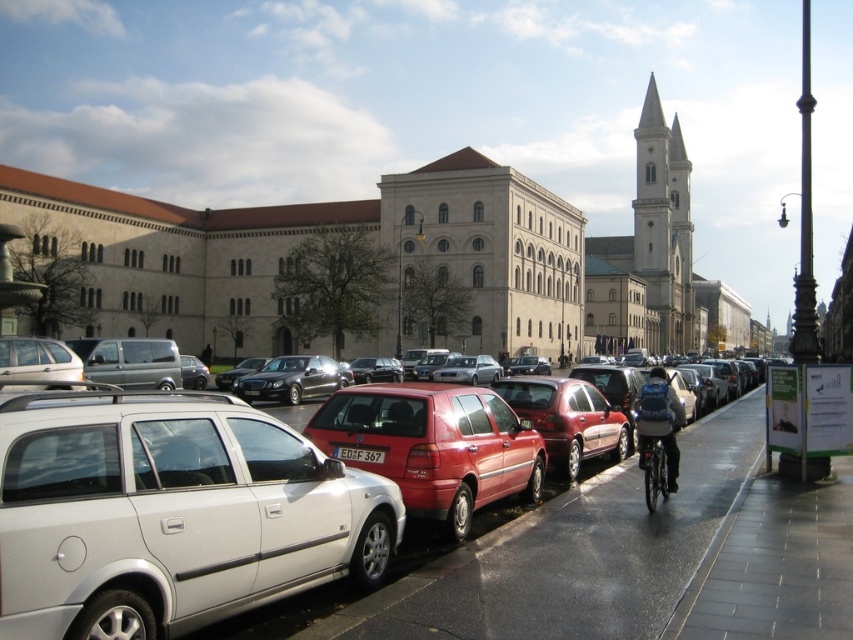
Question: Which object appears farthest from the camera in this image?

Choices:
 (A) metallic silver bicycle at right
 (B) white plastic license plate at center
 (C) matte red hatchback at center

Answer: (A)

Question: Which object is positioned farthest from the white plastic license plate at center?

Choices:
 (A) matte red hatchback at center
 (B) metallic silver bicycle at right

Answer: (B)

Question: Observing the image, what is the correct spatial positioning of metallic silver bicycle at right in reference to white plastic license plate at center?

Choices:
 (A) right
 (B) left

Answer: (A)

Question: Which of the following is the closest to the observer?

Choices:
 (A) (541, 561)
 (B) (340, 448)

Answer: (A)

Question: Can you confirm if matte red hatchback at center is positioned to the left of metallic silver bicycle at right?

Choices:
 (A) no
 (B) yes

Answer: (B)

Question: Can you confirm if matte red hatchback at center is bigger than metallic silver bicycle at right?

Choices:
 (A) yes
 (B) no

Answer: (A)